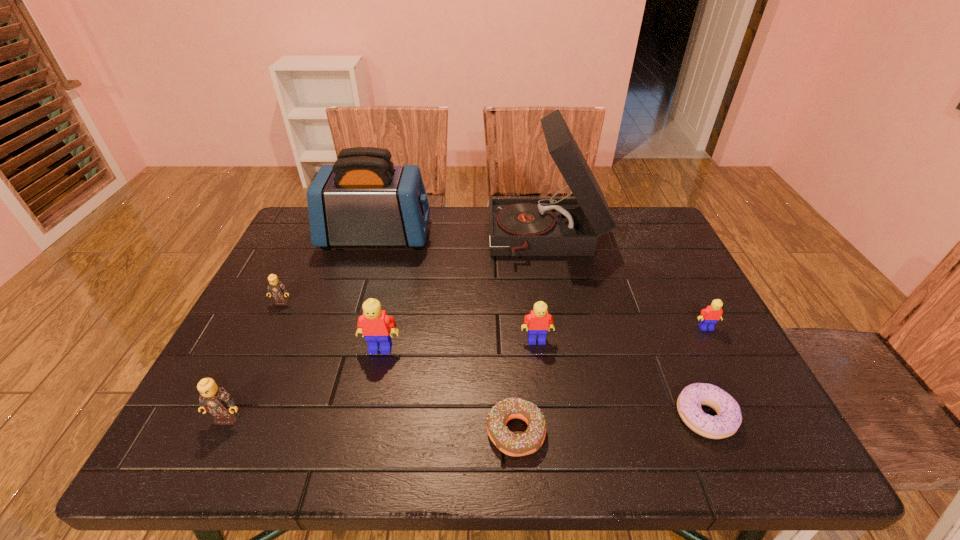
The width and height of the screenshot is (960, 540). Find the location of `the tallest object`. the tallest object is located at coordinates (551, 226).

At what (x,y) coordinates should I click in order to perform the action: click on blue toaster. Please return your answer as a coordinate pair (x, y). Looking at the image, I should click on (363, 199).

Find the location of a particular element. the second tallest object is located at coordinates (363, 199).

The height and width of the screenshot is (540, 960). Find the location of `the third tallest object`. the third tallest object is located at coordinates (374, 324).

This screenshot has width=960, height=540. Identify the location of the biggest yellow Lego. (374, 324).

Where is `the fourth Lego from left to right`? Image resolution: width=960 pixels, height=540 pixels. the fourth Lego from left to right is located at coordinates (539, 321).

Identify the location of the second yellow Lego from left to right. The width and height of the screenshot is (960, 540). (539, 321).

Where is `the nearer tan Lego`? The width and height of the screenshot is (960, 540). the nearer tan Lego is located at coordinates (214, 399).

Find the location of a particular element. The height and width of the screenshot is (540, 960). the nearest Lego is located at coordinates (214, 399).

Locate an element on the screen. This screenshot has width=960, height=540. the second farthest Lego is located at coordinates (709, 316).